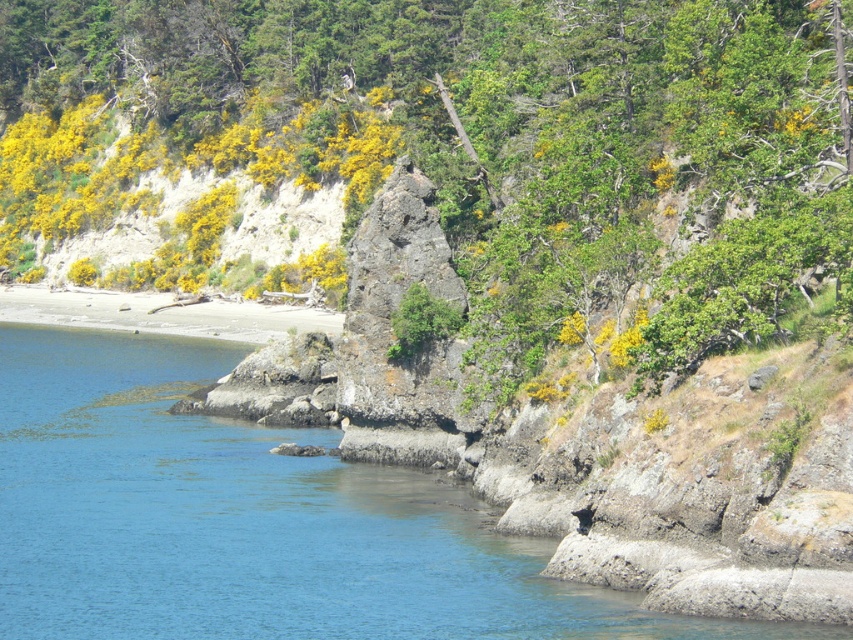
You are standing on the rocky shoreline and want to reach the clear blue water at lower left without getting your feet wet. Is there a path that avoids the sandy beach at lower left?

The clear blue water at lower left is closer to the viewer than the sandy beach at lower left, so you can reach the clear blue water at lower left directly without stepping onto the sandy beach at lower left.

You are standing on the beach and want to take a photo of the clear blue water at lower left without the green leafy tree at center blocking the view. Is it possible to do so without moving the tree?

The clear blue water at lower left is behind the green leafy tree at center, so you cannot take a photo of the clear blue water at lower left without the tree blocking the view unless you move the tree.

You are standing on the rocky shoreline and want to reach the sandy beach at lower left. Which direction should you move relative to the green leafy tree at center?

You should move towards the lower left direction relative to the green leafy tree at center to reach the sandy beach at lower left.